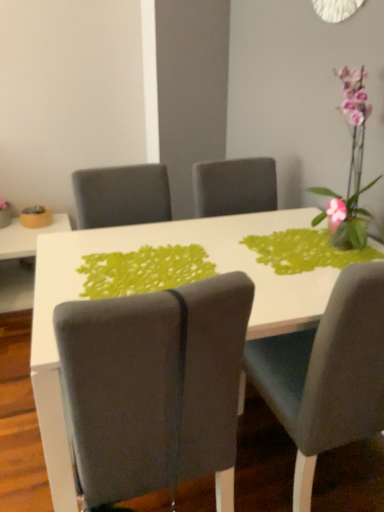
Describe the element at coordinates (22, 261) in the screenshot. The image size is (384, 512). I see `white glossy table at lower left, the first table positioned from the left` at that location.

In order to face velvet gray chair at right, positioned as the second chair in left-to-right order, should I rotate leftwards or rightwards?

You should look right and rotate roughly 17.231 degrees.

The width and height of the screenshot is (384, 512). What do you see at coordinates (327, 373) in the screenshot?
I see `velvet gray chair at right, the 1th chair from the right` at bounding box center [327, 373].

What is the approximate height of white glossy table at center, the 2th table when ordered from left to right?

78.18 centimeters.

The image size is (384, 512). Find the location of `green fabric placemat at center`. green fabric placemat at center is located at coordinates (143, 270).

Could you tell me if pink glass vase at upper right is facing matte yellow bowl at left?

No.

From the image's perspective, is pink glass vase at upper right above or below matte yellow bowl at left?

From the image's perspective, pink glass vase at upper right appears above matte yellow bowl at left.

Is pink glass vase at upper right bigger or smaller than matte yellow bowl at left?

pink glass vase at upper right is bigger than matte yellow bowl at left.

Considering the positions of point (338, 227) and point (202, 268), is point (338, 227) closer or farther from the camera than point (202, 268)?

Point (338, 227) is farther from the camera than point (202, 268).

From the image's perspective, is pink glass vase at upper right beneath green fabric placemat at center?

No, from the image's perspective, pink glass vase at upper right is not below green fabric placemat at center.

Considering the relative sizes of pink glass vase at upper right and green fabric placemat at center in the image provided, is pink glass vase at upper right bigger than green fabric placemat at center?

Indeed, pink glass vase at upper right has a larger size compared to green fabric placemat at center.

Which object is closer to the camera, suede gray chair at center, which ranks as the 2th chair in right-to-left order, or white glossy table at lower left, the first table positioned from the left?

suede gray chair at center, which ranks as the 2th chair in right-to-left order, is more forward.

From a real-world perspective, count 2nd tables downward from the suede gray chair at center, which appears as the 1th chair when viewed from the left, and point to it. Please provide its 2D coordinates.

[(22, 261)]

Is suede gray chair at center, which appears as the 1th chair when viewed from the left, at the right side of white glossy table at lower left, the first table positioned from the left?

Correct, you'll find suede gray chair at center, which appears as the 1th chair when viewed from the left, to the right of white glossy table at lower left, the first table positioned from the left.

Which point is more distant from viewer, [152,445] or [15,264]?

The point [15,264] is more distant.

Is green fabric placemat at center wider than velvet gray chair at right, the 1th chair from the right?

No, green fabric placemat at center is not wider than velvet gray chair at right, the 1th chair from the right.

Which is in front, green fabric placemat at center or velvet gray chair at right, positioned as the second chair in left-to-right order?

velvet gray chair at right, positioned as the second chair in left-to-right order, is closer to the camera.

From the image's perspective, which is above, green fabric placemat at center or velvet gray chair at right, positioned as the second chair in left-to-right order?

green fabric placemat at center appears higher in the image.

From a real-world perspective, is green fabric placemat at center on velvet gray chair at right, positioned as the second chair in left-to-right order?

Yes.

Which is more to the left, white glossy table at center, which ranks as the first table in right-to-left order, or suede gray chair at center, which ranks as the 2th chair in right-to-left order?

Positioned to the left is suede gray chair at center, which ranks as the 2th chair in right-to-left order.

Considering the relative sizes of white glossy table at center, which ranks as the first table in right-to-left order, and suede gray chair at center, which ranks as the 2th chair in right-to-left order, in the image provided, is white glossy table at center, which ranks as the first table in right-to-left order, taller than suede gray chair at center, which ranks as the 2th chair in right-to-left order,?

Yes, white glossy table at center, which ranks as the first table in right-to-left order, is taller than suede gray chair at center, which ranks as the 2th chair in right-to-left order.

From the image's perspective, would you say white glossy table at center, which ranks as the first table in right-to-left order, is shown under suede gray chair at center, which ranks as the 2th chair in right-to-left order?

Actually, white glossy table at center, which ranks as the first table in right-to-left order, appears above suede gray chair at center, which ranks as the 2th chair in right-to-left order, in the image.

Does white glossy table at center, the 2th table when ordered from left to right, come behind suede gray chair at center, which appears as the 1th chair when viewed from the left?

Yes, the depth of white glossy table at center, the 2th table when ordered from left to right, is greater than that of suede gray chair at center, which appears as the 1th chair when viewed from the left.

Is pink glass vase at upper right bigger than white glossy table at lower left, which ranks as the second table in front-to-back order?

Incorrect, pink glass vase at upper right is not larger than white glossy table at lower left, which ranks as the second table in front-to-back order.

Is pink glass vase at upper right far away from white glossy table at lower left, the first table positioned from the left?

Absolutely, pink glass vase at upper right is distant from white glossy table at lower left, the first table positioned from the left.

How different are the orientations of pink glass vase at upper right and white glossy table at lower left, the second table positioned from the right, in degrees?

The angle between the facing direction of pink glass vase at upper right and the facing direction of white glossy table at lower left, the second table positioned from the right, is 89.5 degrees.

Can you confirm if pink glass vase at upper right is taller than white glossy table at lower left, the second table positioned from the right?

Yes.

Which is closer to the camera, (62, 405) or (352, 197)?

Point (62, 405) is positioned closer to the camera compared to point (352, 197).

How far apart are white glossy table at center, which is the 1th table in front-to-back order, and pink glass vase at upper right?

white glossy table at center, which is the 1th table in front-to-back order, and pink glass vase at upper right are 48.37 centimeters apart.

Which object is thinner, white glossy table at center, which is the 1th table in front-to-back order, or pink glass vase at upper right?

With smaller width is pink glass vase at upper right.

Locate an element on the screen. This screenshot has height=512, width=384. the 1st table counting from the left of the pink glass vase at upper right is located at coordinates (157, 245).

What are the coordinates of `houseplant above the matte yellow bowl at left (from the image's perspective)` in the screenshot? It's located at [350, 169].

At what (x,y) coordinates should I click in order to perform the action: click on design on the left of pink glass vase at upper right. Please return your answer as a coordinate pair (x, y). This screenshot has height=512, width=384. Looking at the image, I should click on (143, 270).

Which object lies further to the anchor point green fabric placemat at center, matte yellow bowl at left or suede gray chair at center, which ranks as the 2th chair in right-to-left order?

matte yellow bowl at left lies further to green fabric placemat at center than the other object.

When comparing their distances from white glossy table at lower left, the first table positioned from the left, does matte yellow bowl at left or white glossy table at center, the 2th table when ordered from left to right, seem closer?

Among the two, matte yellow bowl at left is located nearer to white glossy table at lower left, the first table positioned from the left.

When comparing their distances from white glossy table at center, the second table from the back, does suede gray chair at center, which appears as the 1th chair when viewed from the left, or velvet gray chair at right, the 1th chair from the right, seem closer?

suede gray chair at center, which appears as the 1th chair when viewed from the left.

When comparing their distances from velvet gray chair at right, positioned as the second chair in left-to-right order, does green fabric placemat at center or pink glass vase at upper right seem closer?

Among the two, green fabric placemat at center is located nearer to velvet gray chair at right, positioned as the second chair in left-to-right order.

When comparing their distances from pink glass vase at upper right, does suede gray chair at center, which appears as the 1th chair when viewed from the left, or white glossy table at center, which is the 1th table in front-to-back order, seem closer?

white glossy table at center, which is the 1th table in front-to-back order.

Estimate the real-world distances between objects in this image. Which object is closer to green fabric placemat at center, white glossy table at center, the 2th table when ordered from left to right, or pink glass vase at upper right?

white glossy table at center, the 2th table when ordered from left to right.

From the image, which object appears to be nearer to matte yellow bowl at left, pink glass vase at upper right or white glossy table at lower left, which ranks as the second table in front-to-back order?

The object closer to matte yellow bowl at left is white glossy table at lower left, which ranks as the second table in front-to-back order.

From the image, which object appears to be nearer to matte yellow bowl at left, green fabric placemat at center or white glossy table at lower left, which is counted as the first table, starting from the back?

white glossy table at lower left, which is counted as the first table, starting from the back, lies closer to matte yellow bowl at left than the other object.

Where is `design between pink glass vase at upper right and white glossy table at center, the second table from the back, vertically`? design between pink glass vase at upper right and white glossy table at center, the second table from the back, vertically is located at coordinates (143, 270).

This screenshot has width=384, height=512. What are the coordinates of `chair between pink glass vase at upper right and suede gray chair at center, which appears as the 1th chair when viewed from the left, in the up-down direction` in the screenshot? It's located at (327, 373).

Find the location of `design located between white glossy table at center, which is the 1th table in front-to-back order, and white glossy table at lower left, which is counted as the first table, starting from the back, in the depth direction`. design located between white glossy table at center, which is the 1th table in front-to-back order, and white glossy table at lower left, which is counted as the first table, starting from the back, in the depth direction is located at coordinates tap(143, 270).

Identify the location of design positioned between velvet gray chair at right, positioned as the second chair in left-to-right order, and white glossy table at lower left, which ranks as the second table in front-to-back order, from near to far. (143, 270).